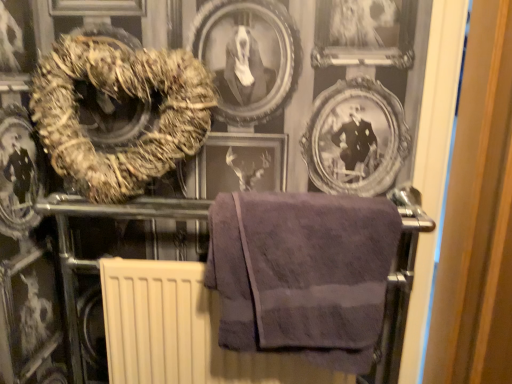
Where is `purple cotton towel at center, which is the 2th towel from top to bottom`? This screenshot has height=384, width=512. purple cotton towel at center, which is the 2th towel from top to bottom is located at coordinates (302, 273).

What do you see at coordinates (302, 273) in the screenshot? The image size is (512, 384). I see `purple cotton towel at center, which is the 2th towel from top to bottom` at bounding box center [302, 273].

Identify the location of purple cotton towel at upper left, positioned as the first towel in left-to-right order. Image resolution: width=512 pixels, height=384 pixels. (119, 114).

What do you see at coordinates (119, 114) in the screenshot?
I see `purple cotton towel at upper left, positioned as the first towel in left-to-right order` at bounding box center [119, 114].

Locate an element on the screen. This screenshot has width=512, height=384. purple cotton towel at center, marked as the second towel in a left-to-right arrangement is located at coordinates (302, 273).

Between purple cotton towel at center, marked as the second towel in a left-to-right arrangement, and purple cotton towel at upper left, positioned as the first towel in left-to-right order, which one appears on the left side from the viewer's perspective?

purple cotton towel at upper left, positioned as the first towel in left-to-right order, is more to the left.

Between purple cotton towel at center, which is the 2th towel from top to bottom, and purple cotton towel at upper left, the 1th towel when ordered from top to bottom, which one is positioned behind?

purple cotton towel at upper left, the 1th towel when ordered from top to bottom, is further away from the camera.

Which is closer to the camera, (298,256) or (170,109)?

Point (298,256) appears to be closer to the viewer than point (170,109).

From the image's perspective, relative to purple cotton towel at upper left, positioned as the first towel in left-to-right order, is purple cotton towel at center, which appears as the 1th towel when ordered from the bottom, above or below?

Based on their image positions, purple cotton towel at center, which appears as the 1th towel when ordered from the bottom, is located beneath purple cotton towel at upper left, positioned as the first towel in left-to-right order.

From a real-world perspective, is purple cotton towel at center, marked as the second towel in a left-to-right arrangement, positioned over purple cotton towel at upper left, positioned as the first towel in left-to-right order, based on gravity?

No, from a real-world perspective, purple cotton towel at center, marked as the second towel in a left-to-right arrangement, is not on top of purple cotton towel at upper left, positioned as the first towel in left-to-right order.

Is purple cotton towel at center, which is the 2th towel from top to bottom, wider or thinner than purple cotton towel at upper left, the 2th towel positioned from the right?

Clearly, purple cotton towel at center, which is the 2th towel from top to bottom, has more width compared to purple cotton towel at upper left, the 2th towel positioned from the right.

Can you confirm if purple cotton towel at center, which appears as the 1th towel when ordered from the bottom, is shorter than purple cotton towel at upper left, the 1th towel when ordered from top to bottom?

Yes.

Considering the sizes of purple cotton towel at center, which is the 2th towel from top to bottom, and purple cotton towel at upper left, the 2th towel positioned from the right, in the image, is purple cotton towel at center, which is the 2th towel from top to bottom, bigger or smaller than purple cotton towel at upper left, the 2th towel positioned from the right,?

Clearly, purple cotton towel at center, which is the 2th towel from top to bottom, is smaller in size than purple cotton towel at upper left, the 2th towel positioned from the right.

In the scene shown: Is purple cotton towel at upper left, positioned as the first towel in left-to-right order, inside purple cotton towel at center, acting as the 1th towel starting from the right?

No.

Are purple cotton towel at center, which appears as the 1th towel when ordered from the bottom, and purple cotton towel at upper left, the 1th towel when ordered from top to bottom, located far from each other?

purple cotton towel at center, which appears as the 1th towel when ordered from the bottom, is actually quite close to purple cotton towel at upper left, the 1th towel when ordered from top to bottom.

Could you tell me if purple cotton towel at center, marked as the second towel in a left-to-right arrangement, is facing purple cotton towel at upper left, the 1th towel when ordered from top to bottom?

No, purple cotton towel at center, marked as the second towel in a left-to-right arrangement, is not facing towards purple cotton towel at upper left, the 1th towel when ordered from top to bottom.

Can you tell me how much purple cotton towel at center, marked as the second towel in a left-to-right arrangement, and purple cotton towel at upper left, positioned as the first towel in left-to-right order, differ in facing direction?

purple cotton towel at center, marked as the second towel in a left-to-right arrangement, and purple cotton towel at upper left, positioned as the first towel in left-to-right order, are facing 0.305 degrees away from each other.

Could you measure the distance between purple cotton towel at center, which is the 2th towel from top to bottom, and purple cotton towel at upper left, the 1th towel when ordered from top to bottom?

purple cotton towel at center, which is the 2th towel from top to bottom, and purple cotton towel at upper left, the 1th towel when ordered from top to bottom, are 13.28 inches apart.

Find the location of a particular element. This screenshot has height=384, width=512. towel located below the purple cotton towel at upper left, positioned as the first towel in left-to-right order (from the image's perspective) is located at coordinates click(x=302, y=273).

Based on their positions, is purple cotton towel at upper left, the 2th towel positioned from the right, located to the left or right of purple cotton towel at center, acting as the 1th towel starting from the right?

In the image, purple cotton towel at upper left, the 2th towel positioned from the right, appears on the left side of purple cotton towel at center, acting as the 1th towel starting from the right.

Is purple cotton towel at upper left, which is the second towel in bottom-to-top order, behind purple cotton towel at center, which appears as the 1th towel when ordered from the bottom?

Yes, purple cotton towel at upper left, which is the second towel in bottom-to-top order, is behind purple cotton towel at center, which appears as the 1th towel when ordered from the bottom.

Is point (83, 175) more distant than point (286, 281)?

Yes, point (83, 175) is farther from viewer.

From the image's perspective, is purple cotton towel at upper left, positioned as the first towel in left-to-right order, positioned above or below purple cotton towel at center, acting as the 1th towel starting from the right?

From the image's perspective, purple cotton towel at upper left, positioned as the first towel in left-to-right order, appears above purple cotton towel at center, acting as the 1th towel starting from the right.

Based on the photo, from a real-world perspective, is purple cotton towel at upper left, the 1th towel when ordered from top to bottom, over purple cotton towel at center, marked as the second towel in a left-to-right arrangement?

Yes, from a real-world perspective, purple cotton towel at upper left, the 1th towel when ordered from top to bottom, is on top of purple cotton towel at center, marked as the second towel in a left-to-right arrangement.

Which of these two, purple cotton towel at upper left, positioned as the first towel in left-to-right order, or purple cotton towel at center, which is the 2th towel from top to bottom, is thinner?

With smaller width is purple cotton towel at upper left, positioned as the first towel in left-to-right order.

Can you confirm if purple cotton towel at upper left, which is the second towel in bottom-to-top order, is shorter than purple cotton towel at center, which appears as the 1th towel when ordered from the bottom?

In fact, purple cotton towel at upper left, which is the second towel in bottom-to-top order, may be taller than purple cotton towel at center, which appears as the 1th towel when ordered from the bottom.

Who is smaller, purple cotton towel at upper left, positioned as the first towel in left-to-right order, or purple cotton towel at center, which appears as the 1th towel when ordered from the bottom?

With smaller size is purple cotton towel at center, which appears as the 1th towel when ordered from the bottom.

Is purple cotton towel at upper left, the 1th towel when ordered from top to bottom, located outside purple cotton towel at center, which is the 2th towel from top to bottom?

purple cotton towel at upper left, the 1th towel when ordered from top to bottom, lies outside purple cotton towel at center, which is the 2th towel from top to bottom,'s area.

Can you see purple cotton towel at upper left, positioned as the first towel in left-to-right order, touching purple cotton towel at center, acting as the 1th towel starting from the right?

purple cotton towel at upper left, positioned as the first towel in left-to-right order, and purple cotton towel at center, acting as the 1th towel starting from the right, are clearly separated.

Is purple cotton towel at upper left, the 1th towel when ordered from top to bottom, aimed at purple cotton towel at center, acting as the 1th towel starting from the right?

No, purple cotton towel at upper left, the 1th towel when ordered from top to bottom, is not aimed at purple cotton towel at center, acting as the 1th towel starting from the right.

Consider the image. How many degrees apart are the facing directions of purple cotton towel at upper left, the 2th towel positioned from the right, and purple cotton towel at center, marked as the second towel in a left-to-right arrangement?

The angular difference between purple cotton towel at upper left, the 2th towel positioned from the right, and purple cotton towel at center, marked as the second towel in a left-to-right arrangement, is 0.305 degrees.

Where is `towel that appears above the purple cotton towel at center, acting as the 1th towel starting from the right (from the image's perspective)`? This screenshot has width=512, height=384. towel that appears above the purple cotton towel at center, acting as the 1th towel starting from the right (from the image's perspective) is located at coordinates (119, 114).

In order to click on towel located above the purple cotton towel at center, marked as the second towel in a left-to-right arrangement (from the image's perspective) in this screenshot , I will do `click(119, 114)`.

This screenshot has width=512, height=384. In order to click on towel that is in front of the purple cotton towel at upper left, the 2th towel positioned from the right in this screenshot , I will do `click(302, 273)`.